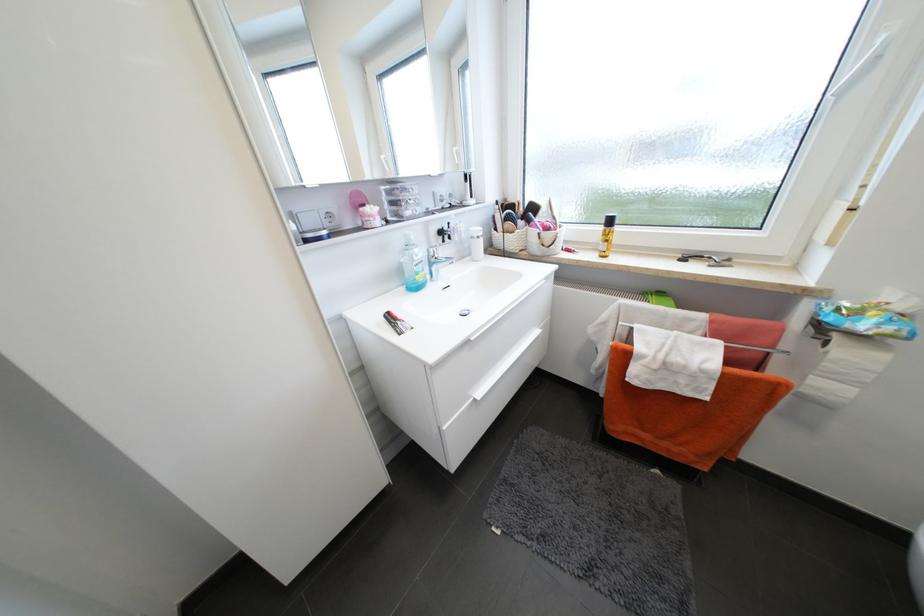
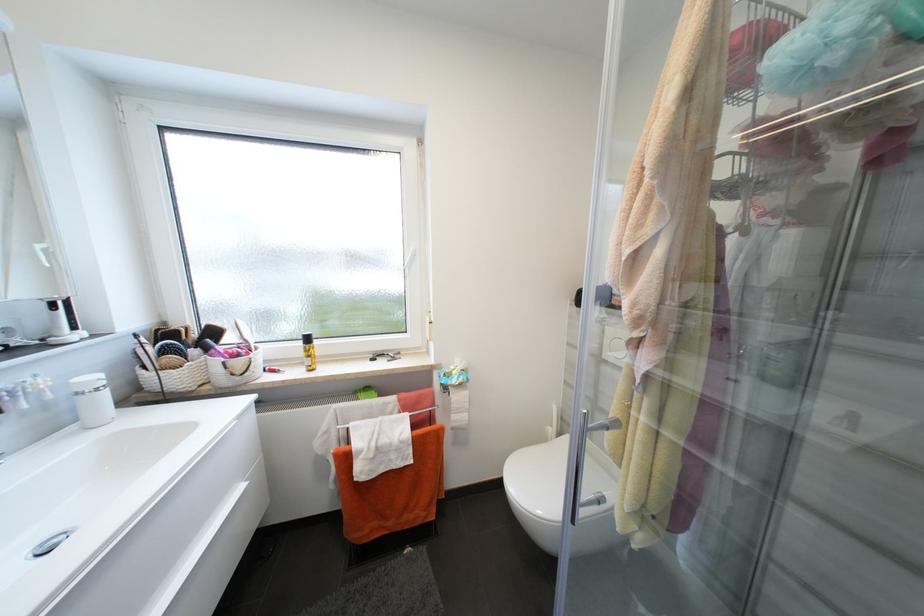
Question: The first image is from the beginning of the video and the second image is from the end. How did the camera likely rotate when shooting the video?

Choices:
 (A) Left
 (B) Right
 (C) Up
 (D) Down

Answer: (B)